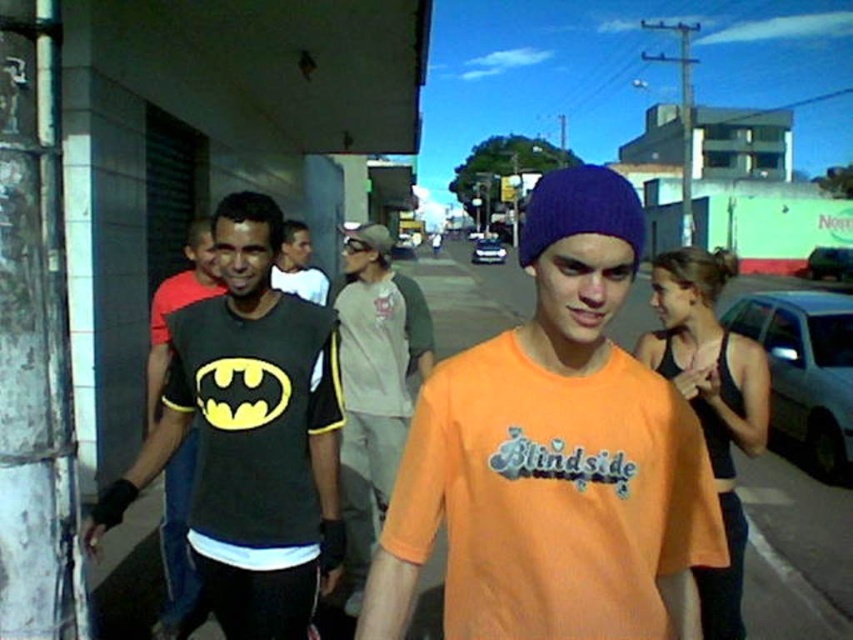
Question: Based on their relative distances, which object is nearer to the orange cotton t-shirt at center?

Choices:
 (A) black matte tank top at right
 (B) black matte t-shirt at left

Answer: (B)

Question: Where is gray cotton sweatshirt at center located in relation to matte black t-shirt at center in the image?

Choices:
 (A) above
 (B) below

Answer: (B)

Question: Does orange cotton t-shirt at center have a lesser width compared to black matte t-shirt at left?

Choices:
 (A) no
 (B) yes

Answer: (B)

Question: Is orange cotton t-shirt at center above black matte t-shirt at left?

Choices:
 (A) no
 (B) yes

Answer: (A)

Question: Which is farther from the gray cotton sweatshirt at center?

Choices:
 (A) matte black t-shirt at left
 (B) black matte t-shirt at left
 (C) matte black t-shirt at center
 (D) orange cotton t-shirt at center

Answer: (D)

Question: Which point is closer to the camera?

Choices:
 (A) orange cotton t-shirt at center
 (B) matte black t-shirt at left

Answer: (A)